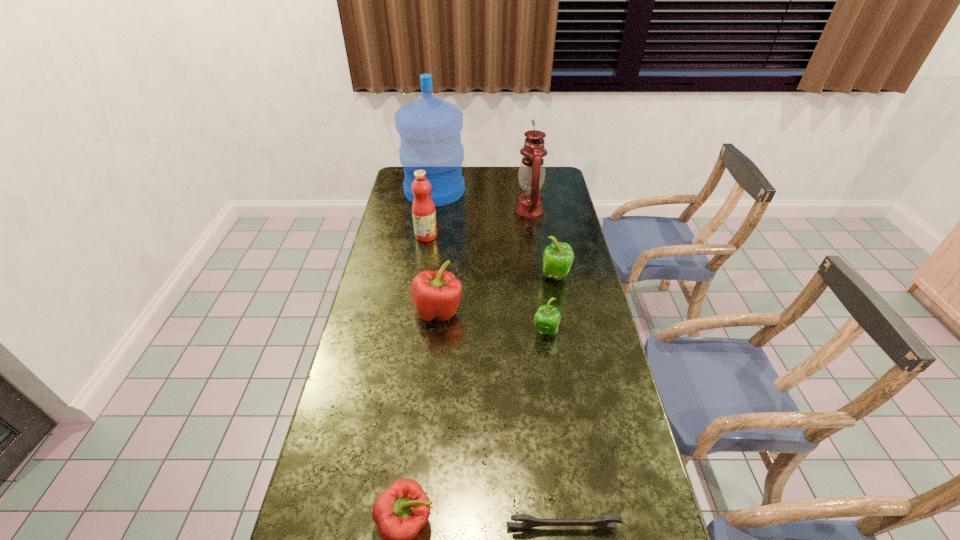
Identify which object is the second nearest to the bigger pink bell pepper. Please provide its 2D coordinates. Your answer should be formatted as a tuple, i.e. [(x, y)], where the tuple contains the x and y coordinates of a point satisfying the conditions above.

[(558, 257)]

You are a GUI agent. You are given a task and a screenshot of the screen. Output one action in this format:
    pyautogui.click(x=<x>, y=<y>)
    Task: Click on the seventh closest object relative to the sixth shortest object
    Image resolution: width=960 pixels, height=540 pixels.
    Given the screenshot: What is the action you would take?
    pyautogui.click(x=603, y=522)

The height and width of the screenshot is (540, 960). Identify the location of bell pepper that is the closest to the nearer pink bell pepper. (435, 295).

The image size is (960, 540). Find the location of `bell pepper that is the second closest to the nearer pink bell pepper`. bell pepper that is the second closest to the nearer pink bell pepper is located at coordinates (547, 318).

Find the location of `vacant space that satisfies the following two spatial constraints: 1. on the front side of the smaller green bell pepper; 2. on the left side of the bigger pink bell pepper`. vacant space that satisfies the following two spatial constraints: 1. on the front side of the smaller green bell pepper; 2. on the left side of the bigger pink bell pepper is located at coordinates (436, 333).

Identify the location of vacant space that satisfies the following two spatial constraints: 1. on the front label of the fruit juice; 2. on the right side of the farther pink bell pepper. Image resolution: width=960 pixels, height=540 pixels. (415, 310).

Where is `free location that satisfies the following two spatial constraints: 1. on the front side of the bigger pink bell pepper; 2. on the left side of the blue water jug`? The height and width of the screenshot is (540, 960). free location that satisfies the following two spatial constraints: 1. on the front side of the bigger pink bell pepper; 2. on the left side of the blue water jug is located at coordinates (418, 310).

The height and width of the screenshot is (540, 960). I want to click on free space that satisfies the following two spatial constraints: 1. on the front side of the water jug; 2. on the left side of the bigger pink bell pepper, so coord(418,310).